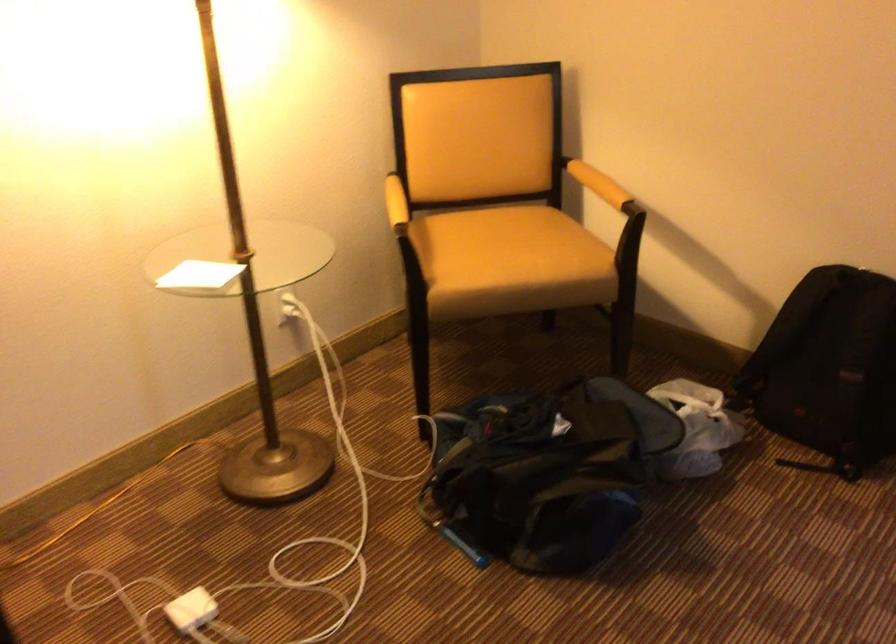
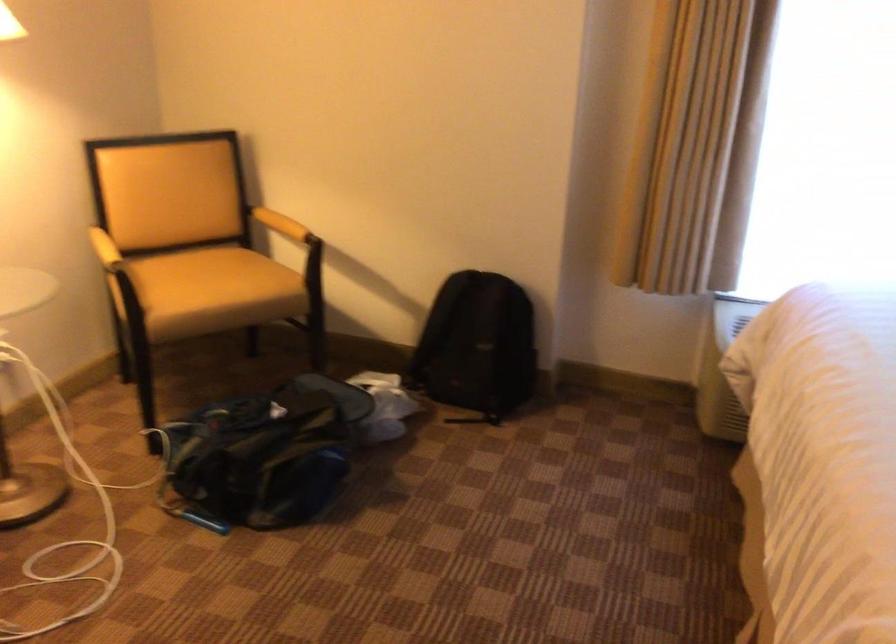
Question: The images are taken continuously from a first-person perspective. In which direction are you moving?

Choices:
 (A) Left
 (B) Right
 (C) Forward
 (D) Backward

Answer: (D)